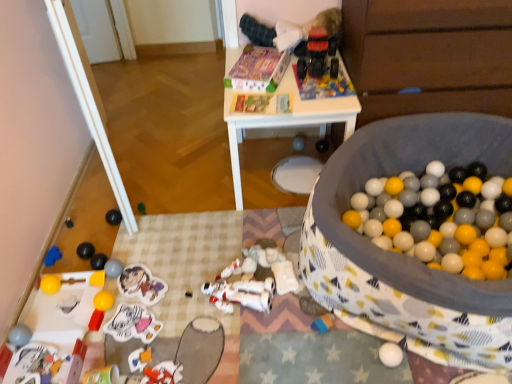
Locate an element on the screen. free area in between matte cardboard stickers at lower center, positioned as the 13th toy in left-to-right order, and matte white sticker at center, the fourteenth toy when ordered from left to right is located at coordinates (139, 307).